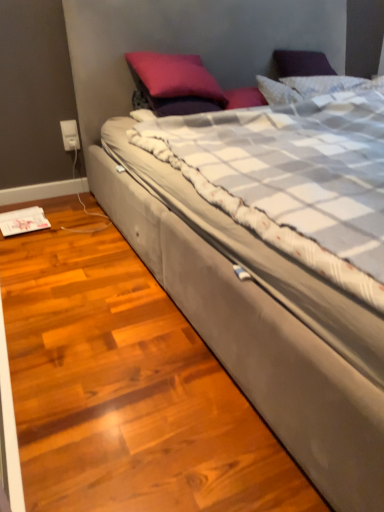
What are the coordinates of `suede bed at center` in the screenshot? It's located at (259, 320).

The width and height of the screenshot is (384, 512). In order to click on satin purple pillow at upper center in this screenshot , I will do `click(175, 76)`.

Is white plastic electric outlet at lower left spatially inside suede bed at center, or outside of it?

white plastic electric outlet at lower left is located beyond the bounds of suede bed at center.

Is the position of white plastic electric outlet at lower left less distant than that of suede bed at center?

That is False.

Does white plastic electric outlet at lower left have a greater width compared to suede bed at center?

Incorrect, the width of white plastic electric outlet at lower left does not surpass that of suede bed at center.

Between suede bed at center and satin purple pillow at upper center, which one has larger size?

Bigger between the two is suede bed at center.

Based on the photo, is suede bed at center oriented away from satin purple pillow at upper center?

Absolutely, suede bed at center is directed away from satin purple pillow at upper center.

From a real-world perspective, who is located lower, suede bed at center or satin purple pillow at upper center?

suede bed at center, from a real-world perspective.

Find the location of a particular element. bed in front of the satin purple pillow at upper center is located at coordinates (259, 320).

In the image, is satin purple pillow at upper center positioned in front of or behind white plastic electric outlet at lower left?

In the image, satin purple pillow at upper center appears in front of white plastic electric outlet at lower left.

Identify the location of pillow that is in front of the white plastic electric outlet at lower left. Image resolution: width=384 pixels, height=512 pixels. (175, 76).

Is satin purple pillow at upper center looking in the opposite direction of white plastic electric outlet at lower left?

No, satin purple pillow at upper center's orientation is not away from white plastic electric outlet at lower left.

Can you confirm if satin purple pillow at upper center is smaller than white plastic electric outlet at lower left?

No, satin purple pillow at upper center is not smaller than white plastic electric outlet at lower left.

Considering the sizes of objects satin purple pillow at upper center and suede bed at center in the image provided, who is taller, satin purple pillow at upper center or suede bed at center?

suede bed at center.

Considering the relative sizes of satin purple pillow at upper center and suede bed at center in the image provided, is satin purple pillow at upper center bigger than suede bed at center?

Incorrect, satin purple pillow at upper center is not larger than suede bed at center.

Is point (180, 92) less distant than point (119, 179)?

That is False.

Can you confirm if satin purple pillow at upper center is positioned to the right of suede bed at center?

Incorrect, satin purple pillow at upper center is not on the right side of suede bed at center.

Which is correct: white plastic electric outlet at lower left is inside satin purple pillow at upper center, or outside of it?

white plastic electric outlet at lower left is not enclosed by satin purple pillow at upper center.

Is white plastic electric outlet at lower left far away from satin purple pillow at upper center?

white plastic electric outlet at lower left is actually quite close to satin purple pillow at upper center.

Which is less distant, (71, 122) or (206, 88)?

Point (71, 122) appears to be farther away from the viewer than point (206, 88).

From the image's perspective, which one is positioned lower, white plastic electric outlet at lower left or satin purple pillow at upper center?

white plastic electric outlet at lower left appears lower in the image.

Considering the relative sizes of suede bed at center and white plastic electric outlet at lower left in the image provided, is suede bed at center shorter than white plastic electric outlet at lower left?

Incorrect, the height of suede bed at center does not fall short of that of white plastic electric outlet at lower left.

Which object is thinner, suede bed at center or white plastic electric outlet at lower left?

white plastic electric outlet at lower left.

Is suede bed at center facing towards white plastic electric outlet at lower left?

No, suede bed at center does not turn towards white plastic electric outlet at lower left.

Is suede bed at center spatially inside white plastic electric outlet at lower left, or outside of it?

suede bed at center lies outside white plastic electric outlet at lower left.

Find the location of a particular element. This screenshot has height=512, width=384. electric outlet lying on the left of suede bed at center is located at coordinates (70, 135).

What are the coordinates of `pillow above the suede bed at center (from the image's perspective)` in the screenshot? It's located at (175, 76).

Estimate the real-world distances between objects in this image. Which object is further from white plastic electric outlet at lower left, satin purple pillow at upper center or suede bed at center?

Based on the image, suede bed at center appears to be further to white plastic electric outlet at lower left.

Which object lies further to the anchor point suede bed at center, white plastic electric outlet at lower left or satin purple pillow at upper center?

The object further to suede bed at center is white plastic electric outlet at lower left.

Considering their positions, is white plastic electric outlet at lower left positioned further to satin purple pillow at upper center than suede bed at center?

suede bed at center.

Considering their positions, is satin purple pillow at upper center positioned further to suede bed at center than white plastic electric outlet at lower left?

The object further to suede bed at center is white plastic electric outlet at lower left.

Considering their positions, is suede bed at center positioned further to white plastic electric outlet at lower left than satin purple pillow at upper center?

Based on the image, suede bed at center appears to be further to white plastic electric outlet at lower left.

Estimate the real-world distances between objects in this image. Which object is closer to satin purple pillow at upper center, suede bed at center or white plastic electric outlet at lower left?

Among the two, white plastic electric outlet at lower left is located nearer to satin purple pillow at upper center.

The width and height of the screenshot is (384, 512). I want to click on pillow positioned between suede bed at center and white plastic electric outlet at lower left from near to far, so click(175, 76).